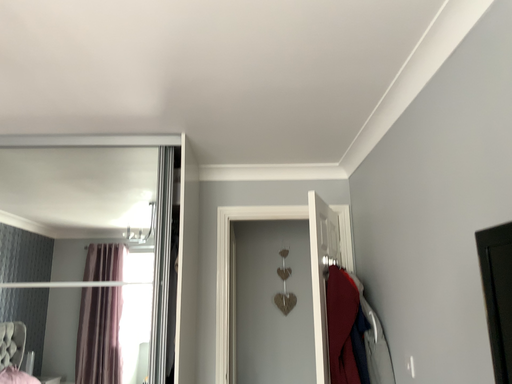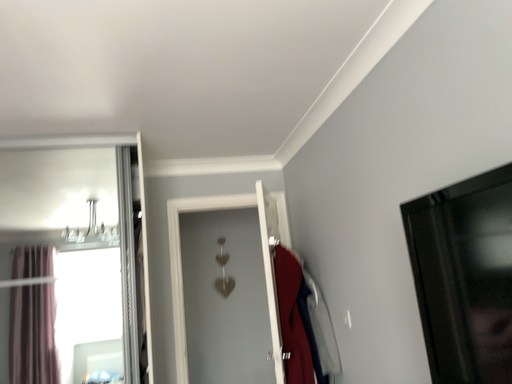
Question: Which way did the camera rotate in the video?

Choices:
 (A) rotated right
 (B) rotated left

Answer: (A)